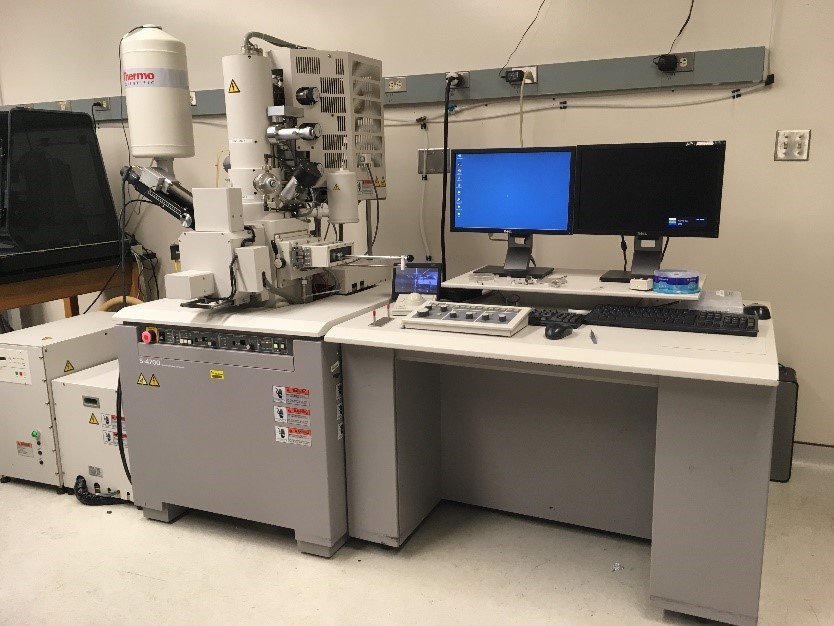
What are the coordinates of `light switches` in the screenshot? It's located at (790, 145), (801, 144).